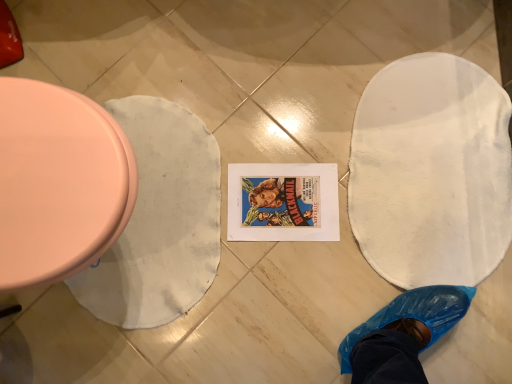
Question: From a real-world perspective, does matte pink toilet at left sit lower than white fabric blanket at left?

Choices:
 (A) no
 (B) yes

Answer: (A)

Question: Can you confirm if matte pink toilet at left is positioned to the right of white fabric blanket at left?

Choices:
 (A) yes
 (B) no

Answer: (B)

Question: Is matte pink toilet at left further to camera compared to white fabric blanket at left?

Choices:
 (A) no
 (B) yes

Answer: (A)

Question: Is the depth of matte pink toilet at left less than that of white fabric blanket at left?

Choices:
 (A) yes
 (B) no

Answer: (A)

Question: Is matte pink toilet at left wider than white fabric blanket at left?

Choices:
 (A) yes
 (B) no

Answer: (A)

Question: Is matte pink toilet at left oriented towards white fabric blanket at left?

Choices:
 (A) no
 (B) yes

Answer: (A)

Question: Is matte pink toilet at left located within white fabric blanket at left?

Choices:
 (A) yes
 (B) no

Answer: (B)

Question: Is white fabric blanket at left facing away from matte pink toilet at left?

Choices:
 (A) yes
 (B) no

Answer: (B)

Question: Is white fabric blanket at left positioned before matte pink toilet at left?

Choices:
 (A) no
 (B) yes

Answer: (A)

Question: From the image's perspective, is white fabric blanket at left located beneath matte pink toilet at left?

Choices:
 (A) yes
 (B) no

Answer: (A)

Question: From a real-world perspective, is white fabric blanket at left beneath matte pink toilet at left?

Choices:
 (A) no
 (B) yes

Answer: (B)

Question: Is the depth of white fabric blanket at left greater than that of matte pink toilet at left?

Choices:
 (A) no
 (B) yes

Answer: (B)

Question: Considering the positions of white fabric blanket at left and matte pink toilet at left in the image, is white fabric blanket at left bigger or smaller than matte pink toilet at left?

Choices:
 (A) small
 (B) big

Answer: (A)